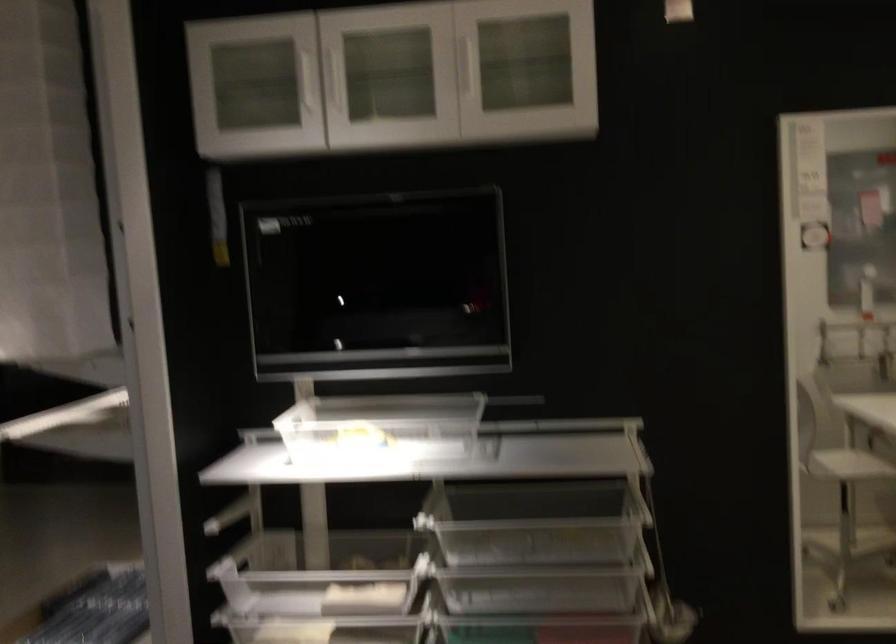
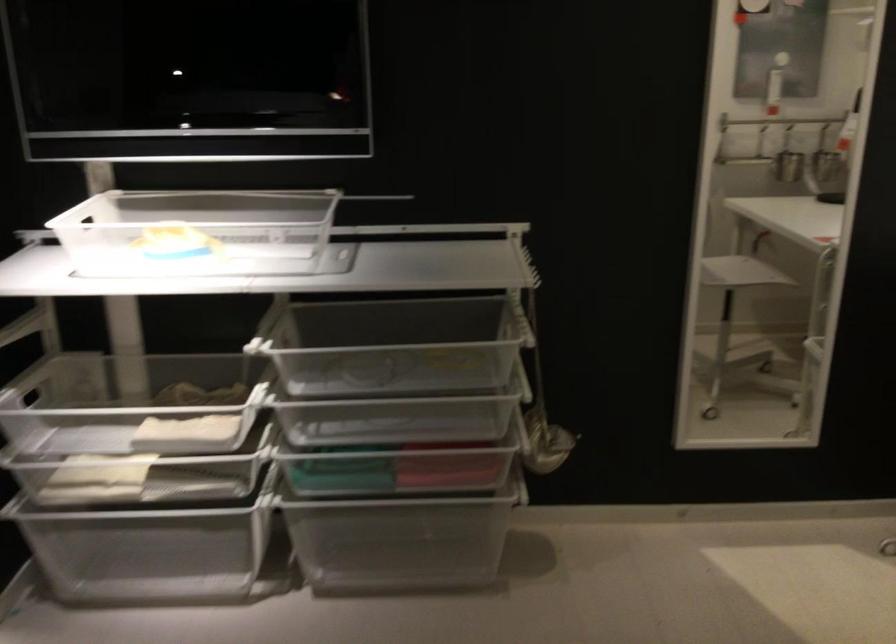
Locate, in the second image, the point that corresponds to [521,534] in the first image.

(382, 357)